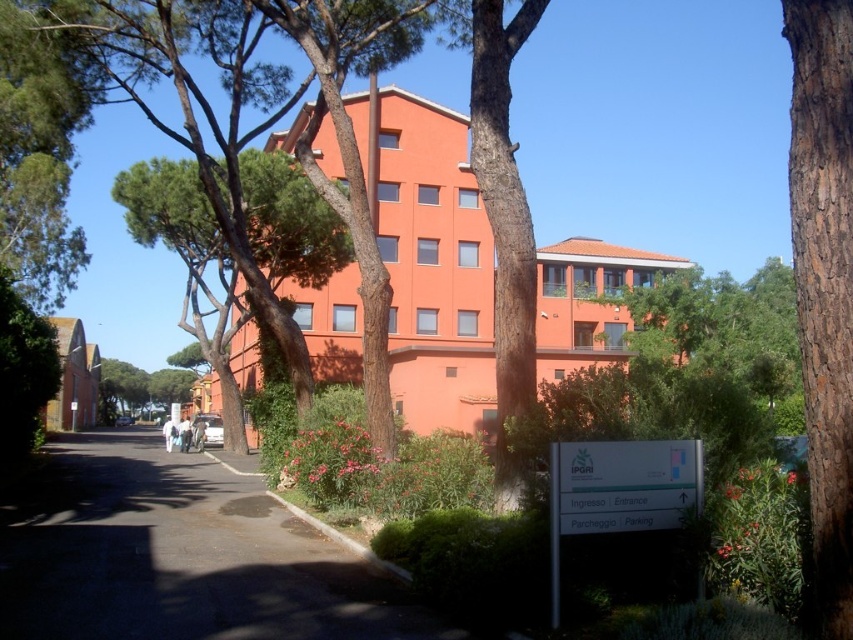
Question: Does green rough bark tree at center have a greater width compared to white plastic sign at lower right?

Choices:
 (A) no
 (B) yes

Answer: (B)

Question: Based on their relative distances, which object is nearer to the brown rough bark tree at right?

Choices:
 (A) white plastic sign at lower right
 (B) green rough bark tree at center
 (C) brown rough bark tree at center

Answer: (A)

Question: Which point is farther to the camera?

Choices:
 (A) green leafy tree at center
 (B) green rough bark tree at center

Answer: (B)

Question: Which point appears farthest from the camera in this image?

Choices:
 (A) (808, 36)
 (B) (637, 448)
 (C) (500, 476)
 (D) (102, 52)

Answer: (D)

Question: Considering the relative positions of green leafy tree at center and brown rough bark tree at right in the image provided, where is green leafy tree at center located with respect to brown rough bark tree at right?

Choices:
 (A) left
 (B) right

Answer: (A)

Question: Can you confirm if green rough bark tree at center is positioned to the left of brown rough bark tree at center?

Choices:
 (A) yes
 (B) no

Answer: (A)